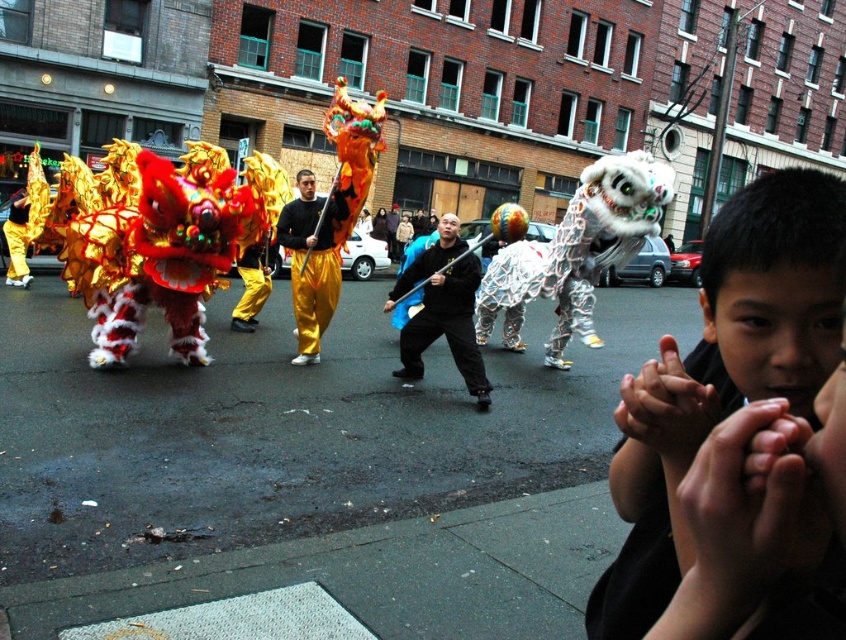
You are a photographer standing in the middle of the street. You want to take a photo of the lion dance performance. There are two points marked in the scene. The first point is at coordinate point (454, 364) and the second point is at coordinate point (295, 324). Which point should you focus on to capture the closer lion dancer to the camera?

Point (454, 364) is closer to the viewer than point (295, 324), so you should focus on point (454, 364) to capture the closer lion dancer to the camera.

You are a photographer trying to capture the lion dance performance. You notice the smooth black shirt at center and the golden silk pants at center. Which clothing item would you need to zoom in more on to ensure it fills the frame properly?

The smooth black shirt at center has a smaller size compared to golden silk pants at center, so you would need to zoom in more on the smooth black shirt at center to ensure it fills the frame properly.

You are a photographer trying to capture the smooth black shirt at center and the golden silk pants at center in a single shot. Which one of these two items will be closer to the camera based on their positions?

The smooth black shirt at center is in front of the golden silk pants at center, so it will be closer to the camera.